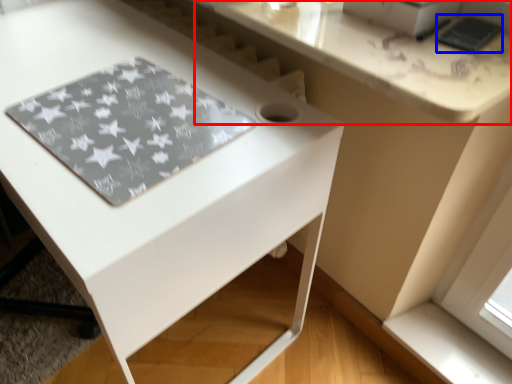
Question: Which object is closer to the camera taking this photo, counter top (highlighted by a red box) or pad (highlighted by a blue box)?

Choices:
 (A) counter top
 (B) pad

Answer: (A)